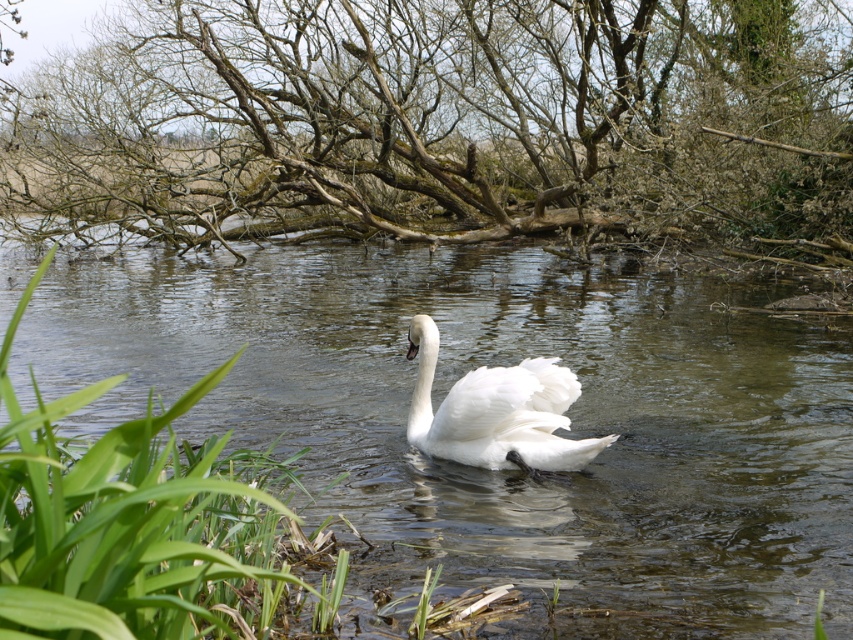
Does point (730, 428) lie in front of point (115, 156)?

Yes, point (730, 428) is in front of point (115, 156).

Find the location of a particular element. clear water at center is located at coordinates (502, 364).

Between point (816, 467) and point (819, 157), which one is positioned in front?

Point (816, 467) is more forward.

Where is `clear water at center`? clear water at center is located at coordinates (502, 364).

Does brown/mossy tree at upper center appear over white feathered swan at center?

Yes, brown/mossy tree at upper center is above white feathered swan at center.

Which is more to the left, brown/mossy tree at upper center or white feathered swan at center?

Positioned to the left is brown/mossy tree at upper center.

Image resolution: width=853 pixels, height=640 pixels. I want to click on brown/mossy tree at upper center, so click(x=440, y=122).

Who is more forward, [753,312] or [450,458]?

Point [450,458] is in front.

You are a GUI agent. You are given a task and a screenshot of the screen. Output one action in this format:
    pyautogui.click(x=<x>, y=<y>)
    Task: Click on the clear water at center
    The width and height of the screenshot is (853, 640).
    Given the screenshot: What is the action you would take?
    pyautogui.click(x=502, y=364)

Locate an element on the screen. clear water at center is located at coordinates (502, 364).